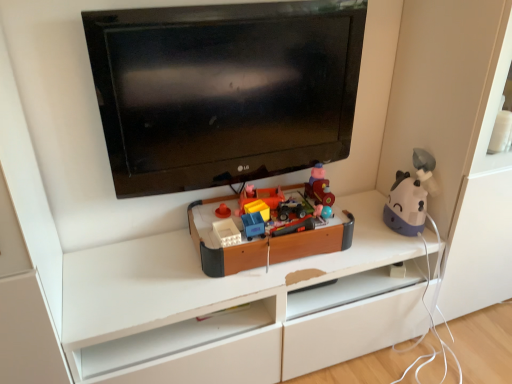
Find the location of `free point above black glossy tv at upper center (from a real-world perspective)`. free point above black glossy tv at upper center (from a real-world perspective) is located at coordinates (226, 4).